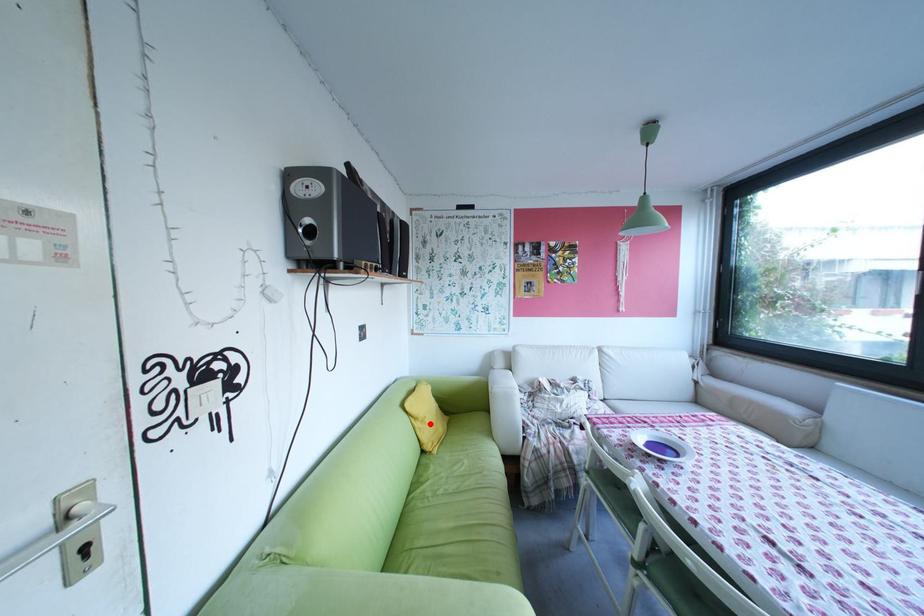
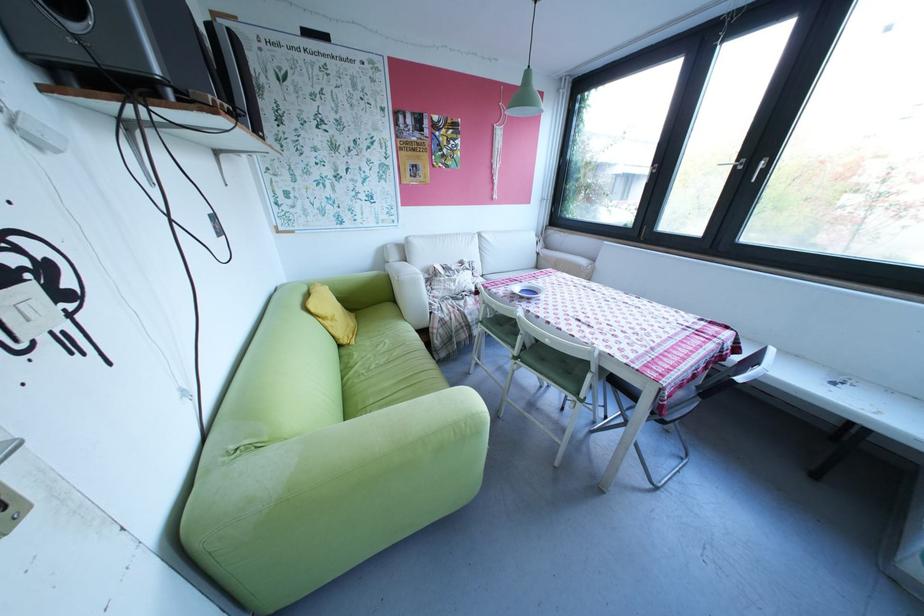
In the second image, find the point that corresponds to the highlighted location in the first image.

(339, 323)